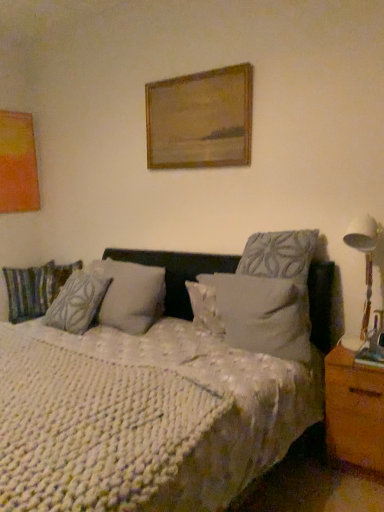
Question: Considering the positions of white fabric lampshade at right and textured gray pillow at center, the 3th pillow positioned from the front, in the image, is white fabric lampshade at right wider or thinner than textured gray pillow at center, the 3th pillow positioned from the front,?

Choices:
 (A) thin
 (B) wide

Answer: (B)

Question: From the image's perspective, is white fabric lampshade at right above or below textured gray pillow at center, which is the second pillow in back-to-front order?

Choices:
 (A) above
 (B) below

Answer: (A)

Question: Considering the real-world distances, which object is closest to the textured gray pillow at center, the second pillow when ordered from front to back?

Choices:
 (A) striped fabric pillow at left, the 4th pillow viewed from the right
 (B) wooden framed painting at upper center
 (C) white knitted blanket at center
 (D) brown wood nightstand at lower right
 (E) textured gray pillow at center, acting as the second pillow starting from the left

Answer: (C)

Question: Considering the real-world distances, which object is closest to the white knitted blanket at center?

Choices:
 (A) white fabric lampshade at right
 (B) white knitted mattress at center
 (C) textured gray pillow at center, which appears as the first pillow when viewed from the right
 (D) textured gray pillow at center, which is the 3th pillow from right to left
 (E) striped fabric pillow at left, marked as the 1th pillow in a back-to-front arrangement

Answer: (B)